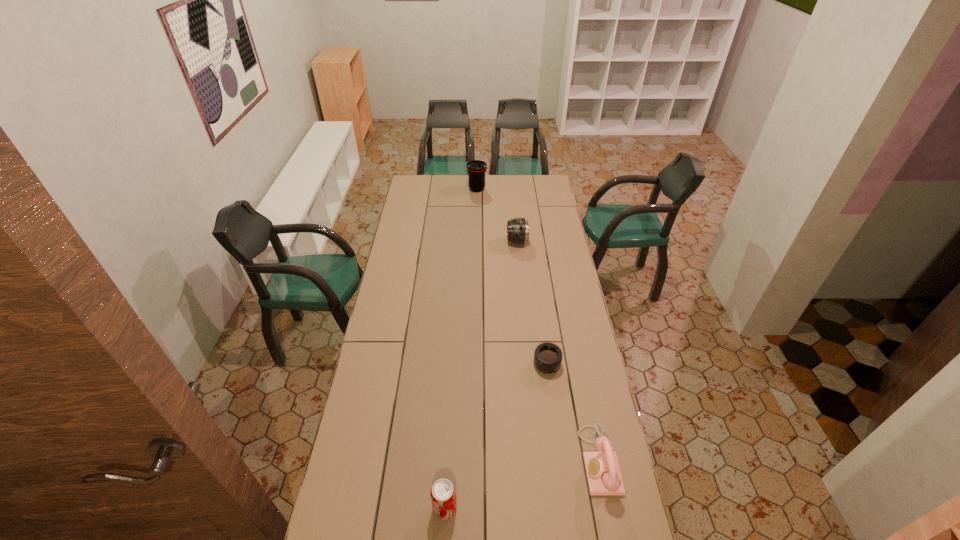
The width and height of the screenshot is (960, 540). I want to click on the leftmost telephoto lens, so click(x=476, y=169).

Locate an element on the screen. The image size is (960, 540). the farthest object is located at coordinates (476, 169).

Where is `the second tallest telephoto lens`? The image size is (960, 540). the second tallest telephoto lens is located at coordinates (518, 228).

Find the location of a particular element. the fourth nearest object is located at coordinates (518, 228).

Where is `telephone`? telephone is located at coordinates (603, 473).

Locate an element on the screen. This screenshot has height=540, width=960. soda can is located at coordinates (443, 494).

You are a GUI agent. You are given a task and a screenshot of the screen. Output one action in this format:
    pyautogui.click(x=<x>, y=<y>)
    Task: Click on the third nearest object
    The height and width of the screenshot is (540, 960).
    Given the screenshot: What is the action you would take?
    pyautogui.click(x=548, y=357)

The height and width of the screenshot is (540, 960). What are the coordinates of `the nearest telephoto lens` in the screenshot? It's located at (548, 357).

This screenshot has width=960, height=540. Identify the location of free space located on the front of the farthest object. (476, 232).

At what (x,y) coordinates should I click in order to perform the action: click on free space located at the front element of the second farthest object. Please return your answer as a coordinate pair (x, y). Looking at the image, I should click on (455, 241).